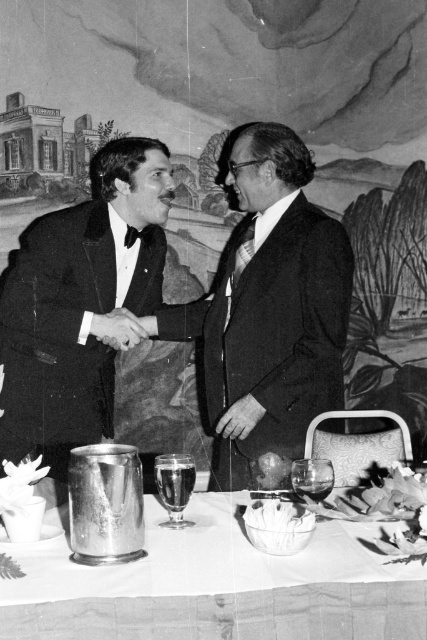
You are a waiter at a formal event and need to retrieve the metallic silver pitcher at lower center. The shiny black tuxedo at center is blocking your path. Can you reach the pitcher without moving the tuxedo?

The metallic silver pitcher at lower center is positioned under the shiny black tuxedo at center, so you can reach it without moving the tuxedo since it is located beneath it.

You are standing at the entrance of the banquet hall and want to place a 30 inch long decorative ribbon between the shiny black suit at center and the metallic silver pitcher at lower center. Can the ribbon fit between them without overlapping either object?

The distance between the shiny black suit at center and the metallic silver pitcher at lower center is 35.41 inches. Since the ribbon is 30 inches long, it can fit between them without overlapping either object as 30 is less than 35.41.